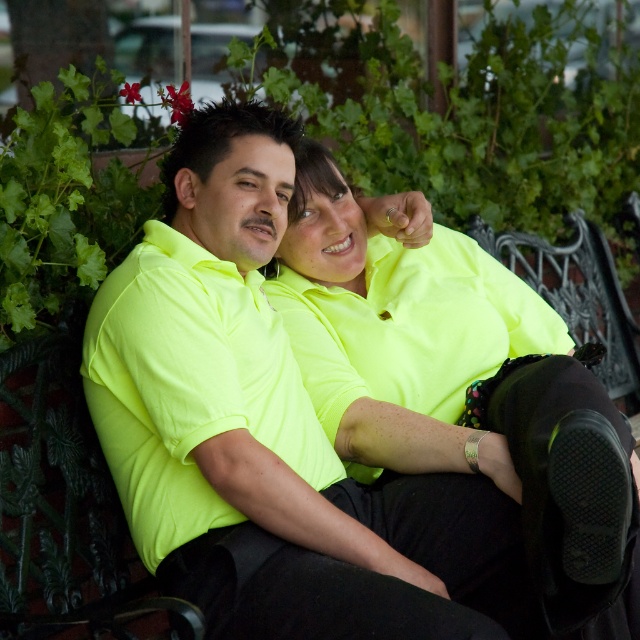
Question: Among these points, which one is nearest to the camera?

Choices:
 (A) (273, 321)
 (B) (481, 605)

Answer: (B)

Question: In this image, where is neon yellow shirt at center located relative to neon yellow polo shirt at center?

Choices:
 (A) right
 (B) left

Answer: (A)

Question: Is neon yellow shirt at center below neon yellow polo shirt at center?

Choices:
 (A) yes
 (B) no

Answer: (A)

Question: Which object appears farthest from the camera in this image?

Choices:
 (A) neon yellow shirt at center
 (B) neon yellow polo shirt at center

Answer: (B)

Question: Which point appears farthest from the camera in this image?

Choices:
 (A) (163, 435)
 (B) (236, 273)

Answer: (B)

Question: Is neon yellow shirt at center further to the viewer compared to neon yellow polo shirt at center?

Choices:
 (A) yes
 (B) no

Answer: (B)